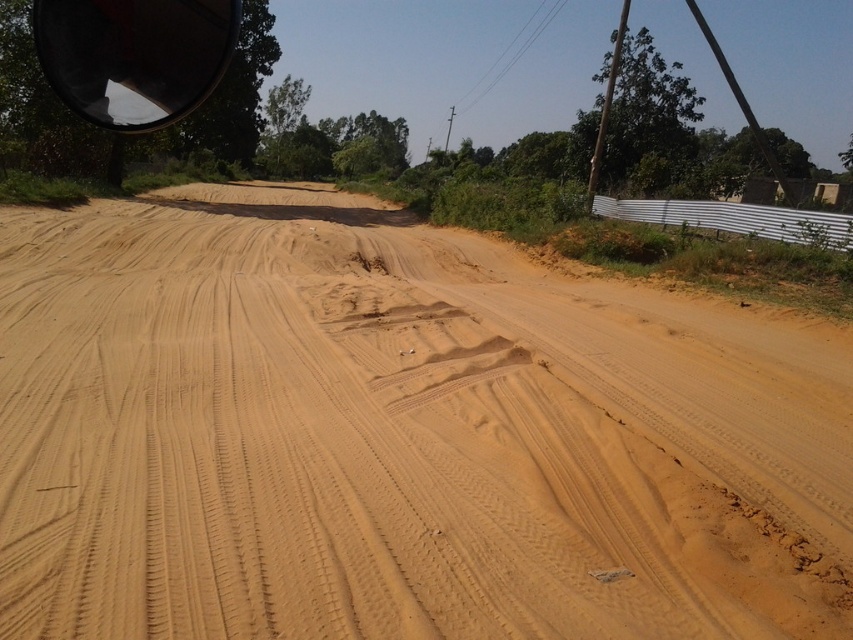
You are driving a car and looking out the side window. You see the brown sandy dirt at center and the black reflective view mirror at upper left. Which object is positioned to the right of the other?

The brown sandy dirt at center is to the right of the black reflective view mirror at upper left.

You are driving a car and want to check the blind spot on the right side of the road. You can see the brown sandy dirt at center and the black reflective view mirror at upper left. Which object is closer to you when looking through the windshield?

The brown sandy dirt at center is closer to the viewer than the black reflective view mirror at upper left, so the brown sandy dirt at center would be closer when looking through the windshield.